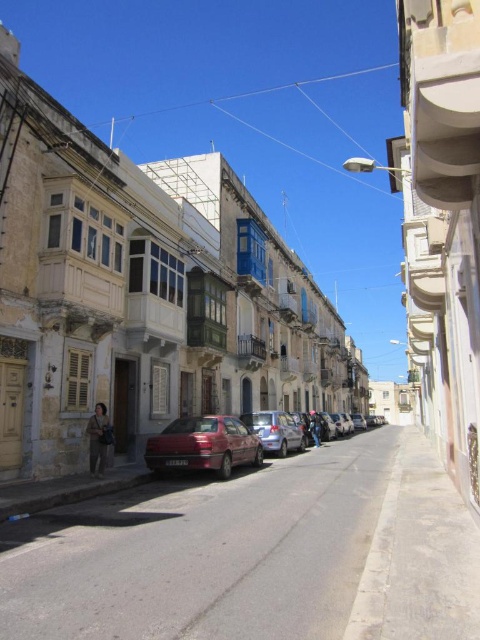
Consider the image. You are a pedestrian standing at the entrance of the street. You see a shiny red car at center and a metallic silver car at center. Which car is nearer to you?

The shiny red car at center is closer to the viewer than metallic silver car at center, so the shiny red car at center is nearer to you.

You are a delivery person trying to park your van in this narrow street. You see the shiny red car at center and the metallic silver car at center. Which car is taller and might block the path for your van?

The shiny red car at center is much taller than the metallic silver car at center, so it might block the path for your van.

You are standing at the intersection of the street and want to find the shiny red car at center. Based on the coordinates provided, in which direction should you look relative to your position?

The shiny red car at center is located at coordinates point (x=203, y=445). Since the coordinates are based on a standard grid system where the origin is at the bottom left corner, the car is positioned to the right and slightly above your current position at the intersection. Therefore, you should look towards the upper right direction to find it.